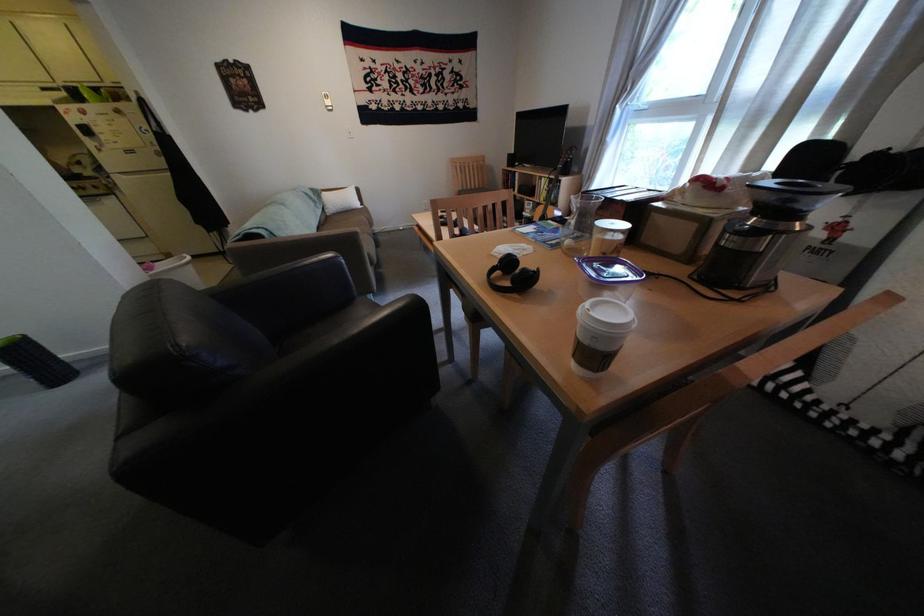
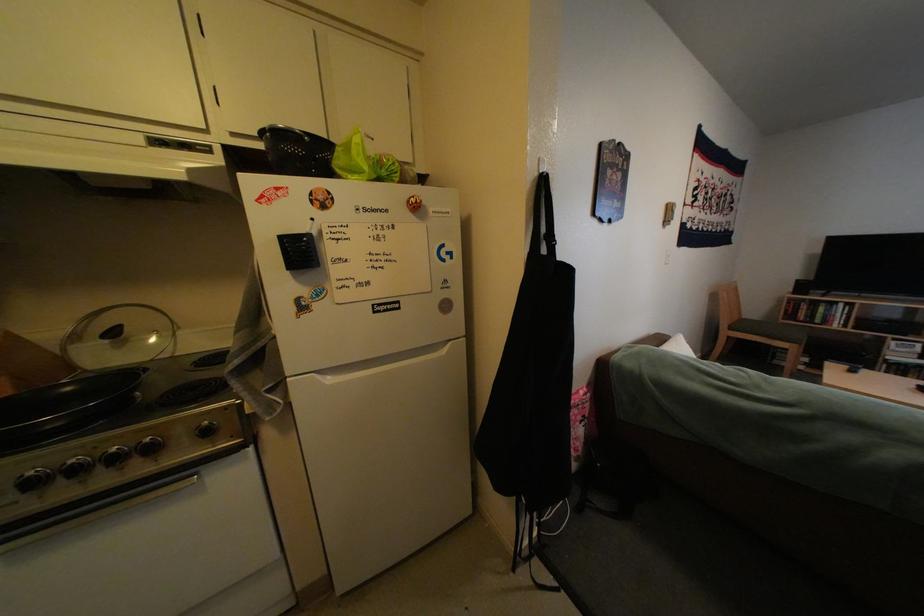
Locate, in the second image, the point that corresponds to pixel 526 161 in the first image.

(816, 288)